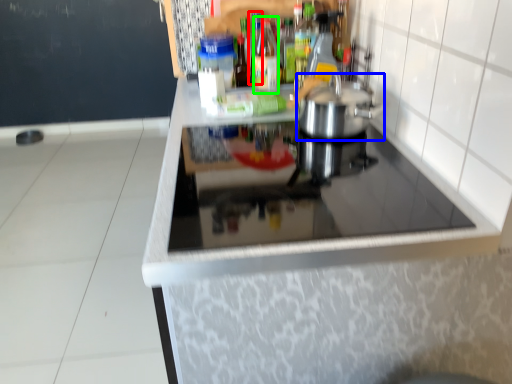
Question: Based on their relative distances, which object is farther from bottle (highlighted by a red box)? Choose from kitchen appliance (highlighted by a blue box) and bottle (highlighted by a green box).

Choices:
 (A) kitchen appliance
 (B) bottle

Answer: (A)